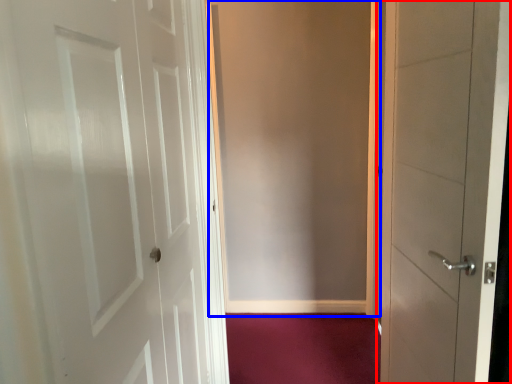
Question: Which object is further to the camera taking this photo, door (highlighted by a red box) or screen door (highlighted by a blue box)?

Choices:
 (A) door
 (B) screen door

Answer: (B)